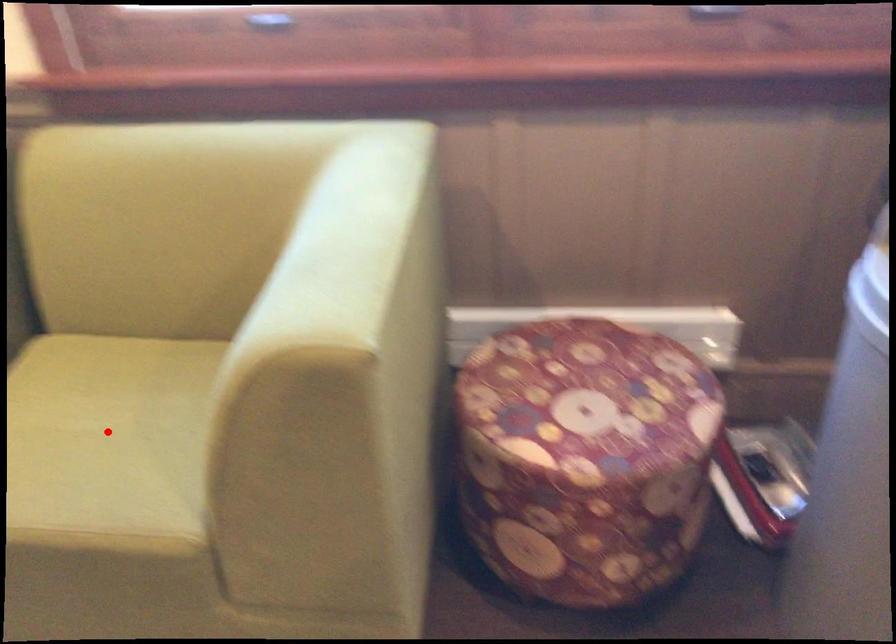
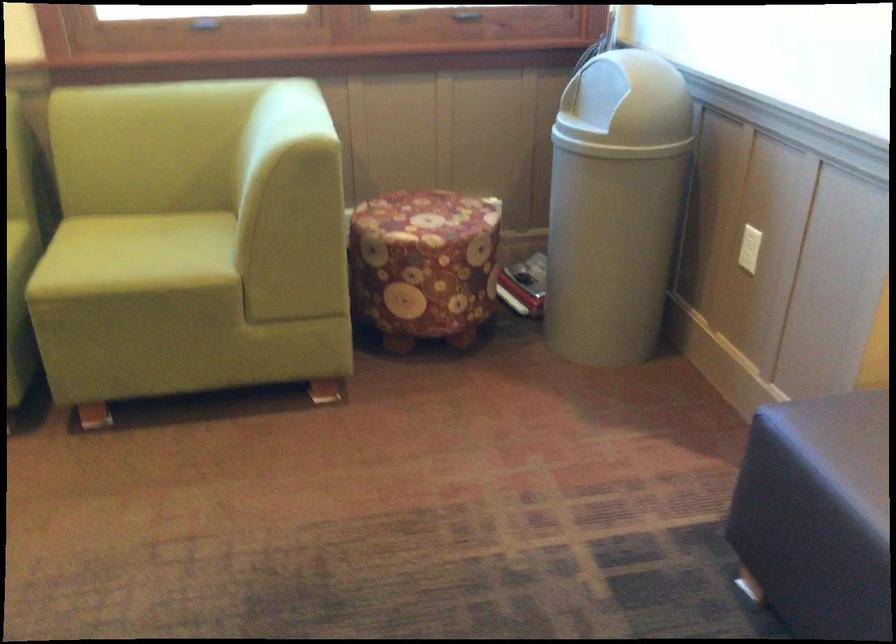
Question: A red point is marked in image1. In image2, is the corresponding 3D point closer to the camera or farther? Reply with the corresponding letter.

Choices:
 (A) The corresponding 3D point is closer.
 (B) The corresponding 3D point is farther.

Answer: (B)